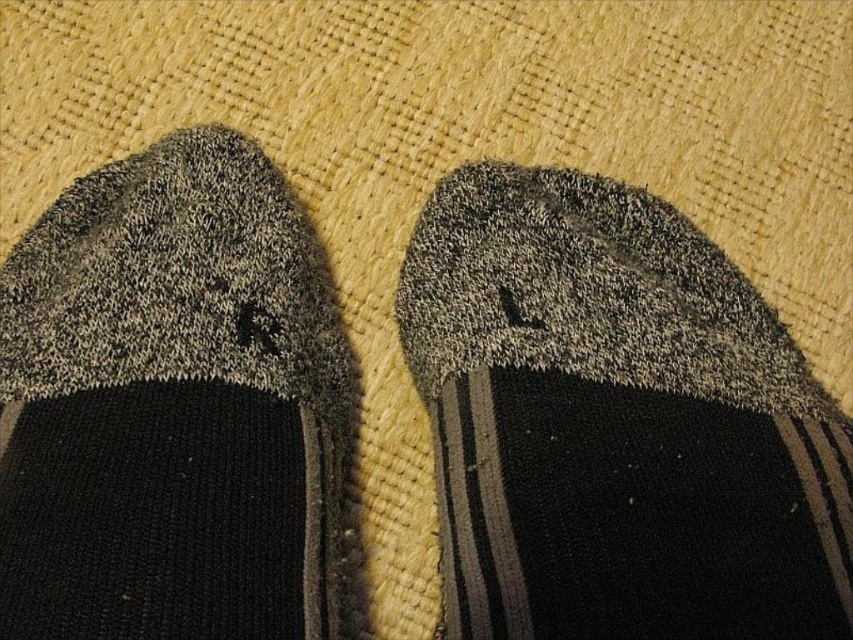
Is point (422, 262) positioned behind point (213, 260)?

That is True.

Does textured gray sock at center come in front of knit fabric sock at left?

That is False.

Image resolution: width=853 pixels, height=640 pixels. Describe the element at coordinates (616, 422) in the screenshot. I see `textured gray sock at center` at that location.

This screenshot has width=853, height=640. In order to click on textured gray sock at center in this screenshot , I will do `click(616, 422)`.